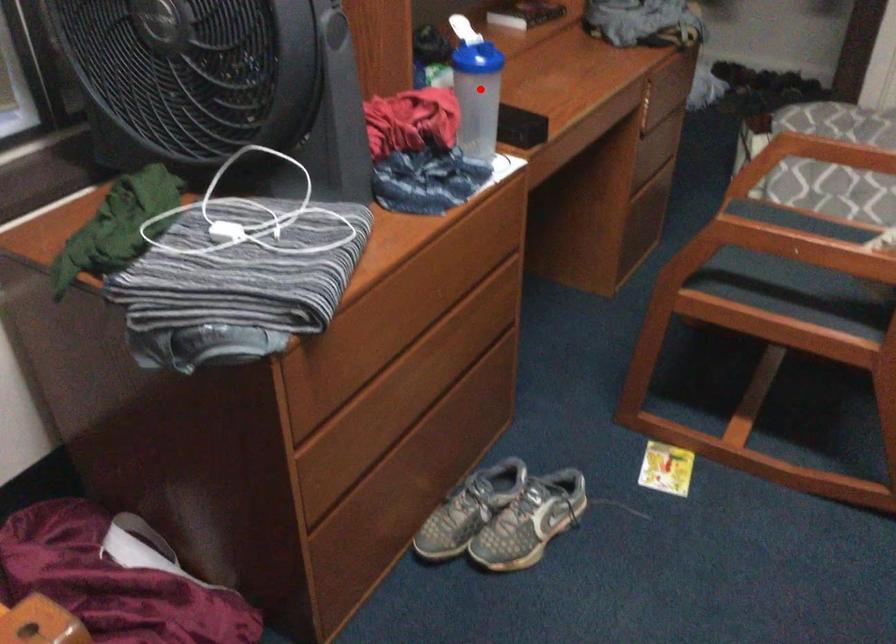
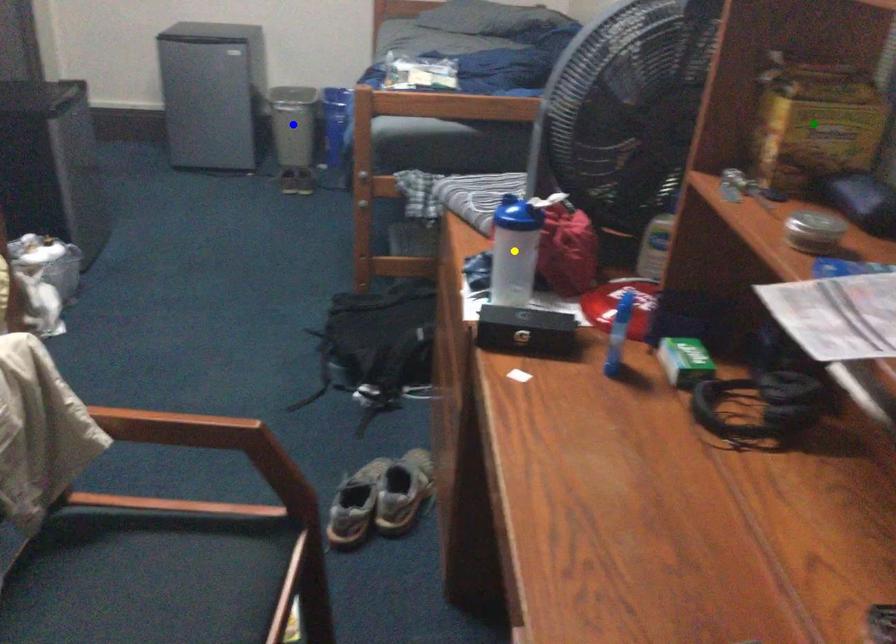
Question: I am providing you with two images of the same scene from different viewpoints. A red point is marked on the first image. You are given multiple points on the second image. Which spot in image 2 lines up with the point in image 1?

Choices:
 (A) blue point
 (B) green point
 (C) yellow point

Answer: (C)